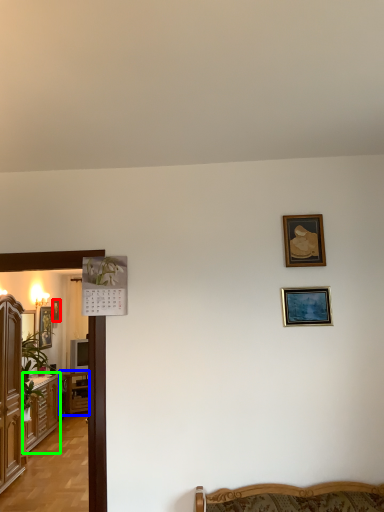
Question: Considering the real-world distances, which object is closest to picture frame (highlighted by a red box)? table (highlighted by a blue box) or cabinetry (highlighted by a green box).

Choices:
 (A) table
 (B) cabinetry

Answer: (A)